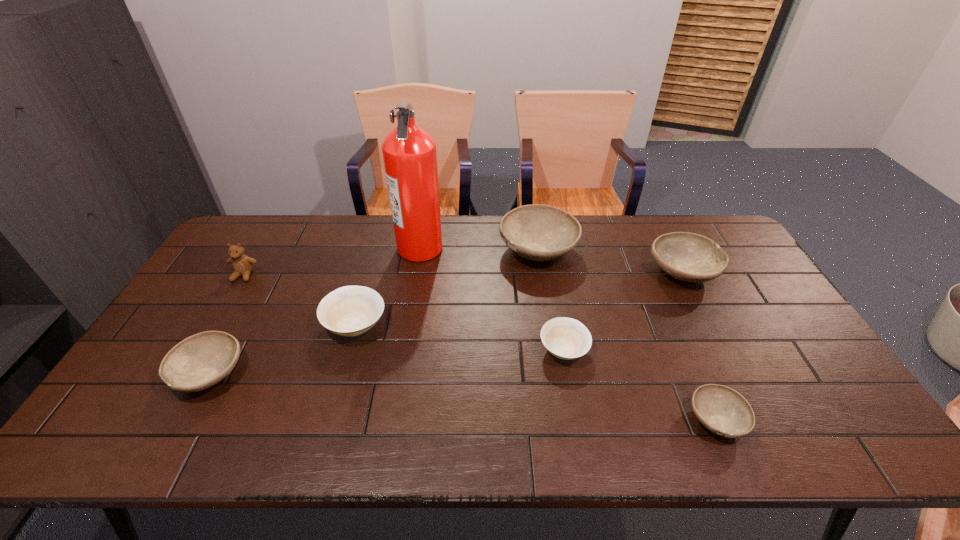
You are a GUI agent. You are given a task and a screenshot of the screen. Output one action in this format:
    pyautogui.click(x=<x>, y=<y>)
    Task: Click on the tallest object
    This screenshot has height=540, width=960.
    Given the screenshot: What is the action you would take?
    click(409, 152)

Where is `teddy bear`? The image size is (960, 540). teddy bear is located at coordinates (242, 265).

This screenshot has height=540, width=960. Identify the location of the second gray bowl from left to right. (537, 232).

Where is `the biggest gray bowl`? The width and height of the screenshot is (960, 540). the biggest gray bowl is located at coordinates (537, 232).

This screenshot has height=540, width=960. What are the coordinates of `the third smallest gray bowl` in the screenshot? It's located at (689, 257).

Identify the location of the left beige bowl. Image resolution: width=960 pixels, height=540 pixels. (350, 310).

At what (x,y) coordinates should I click in order to perform the action: click on the bigger beige bowl. Please return your answer as a coordinate pair (x, y). Looking at the image, I should click on (350, 310).

Image resolution: width=960 pixels, height=540 pixels. Find the location of `the leftmost bowl`. the leftmost bowl is located at coordinates (200, 361).

Find the location of `the leftmost gray bowl`. the leftmost gray bowl is located at coordinates (200, 361).

This screenshot has height=540, width=960. Find the location of `the smaller beige bowl`. the smaller beige bowl is located at coordinates (566, 338).